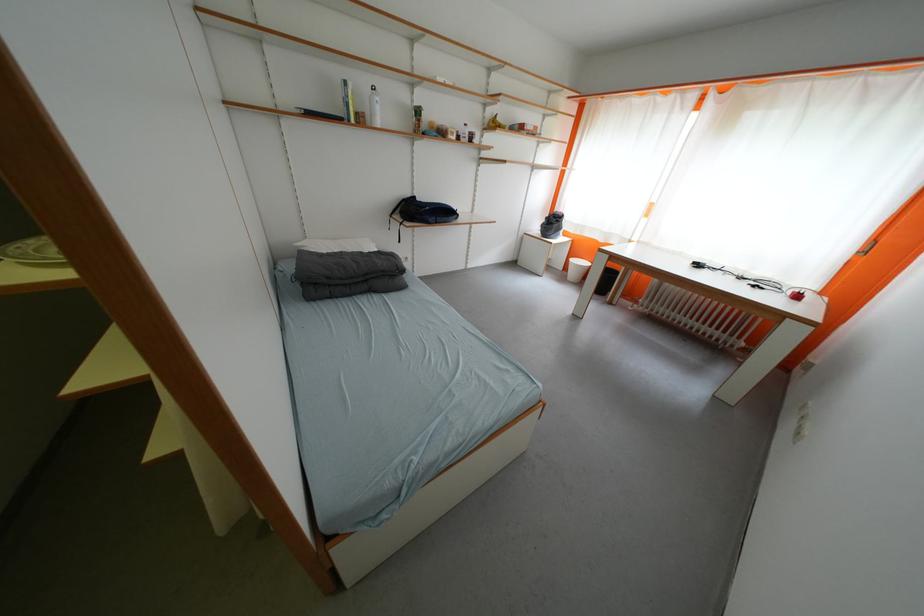
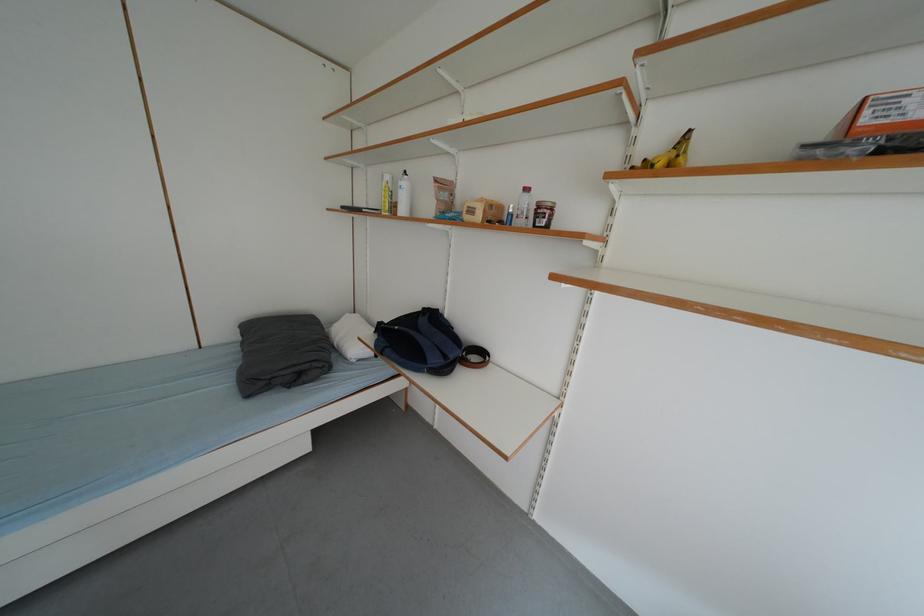
Find the pixel in the second image that matches point 464,140 in the first image.

(487, 220)